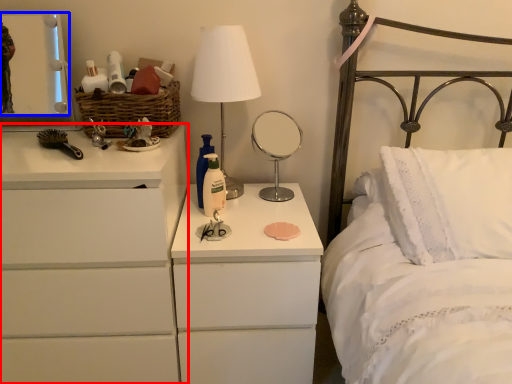
Question: Among these objects, which one is nearest to the camera, chest of drawers (highlighted by a red box) or mirror (highlighted by a blue box)?

Choices:
 (A) chest of drawers
 (B) mirror

Answer: (A)